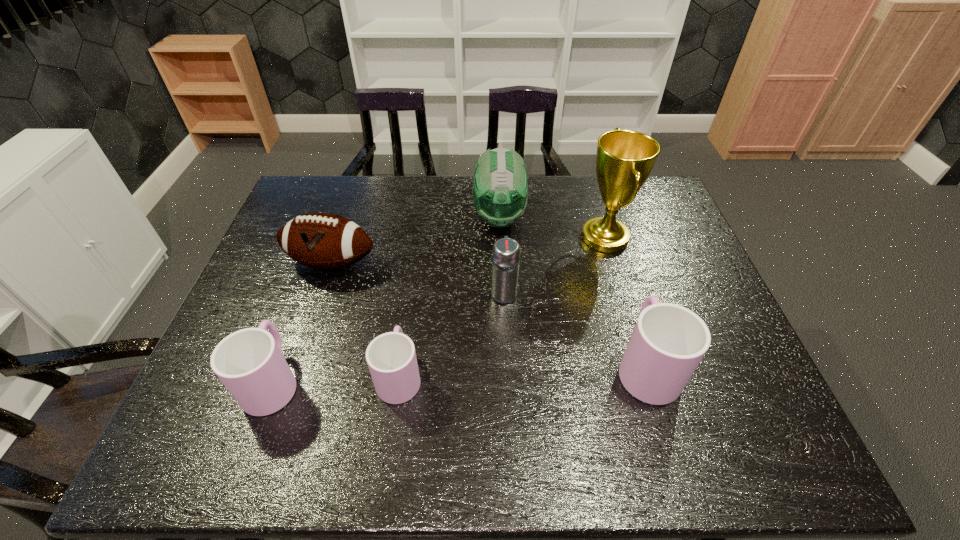
What are the coordinates of `vacant region between the football (American) and the award` in the screenshot? It's located at click(468, 250).

Locate an element on the screen. Image resolution: width=960 pixels, height=540 pixels. vacant space that is in between the leftmost cup and the third object from left to right is located at coordinates (336, 378).

What are the coordinates of `vacant area that lies between the award and the leftmost cup` in the screenshot? It's located at (439, 309).

The height and width of the screenshot is (540, 960). I want to click on unoccupied area between the rightmost cup and the thermos bottle, so click(575, 329).

Locate an element on the screen. The width and height of the screenshot is (960, 540). the second closest object to the football (American) is located at coordinates (391, 357).

This screenshot has width=960, height=540. I want to click on object that is the sixth nearest to the football (American), so click(668, 342).

At what (x,y) coordinates should I click in order to perform the action: click on the closest cup to the football helmet. Please return your answer as a coordinate pair (x, y). The height and width of the screenshot is (540, 960). Looking at the image, I should click on (668, 342).

Locate which cup ranks second in proximity to the football (American). Please provide its 2D coordinates. Your answer should be formatted as a tuple, i.e. [(x, y)], where the tuple contains the x and y coordinates of a point satisfying the conditions above.

[(391, 357)]

Locate an element on the screen. The width and height of the screenshot is (960, 540). vacant area in the image that satisfies the following two spatial constraints: 1. with the handle on the side of the rightmost cup; 2. by the handles of the tallest object is located at coordinates (607, 238).

Find the location of a particular element. This screenshot has width=960, height=540. free space that satisfies the following two spatial constraints: 1. with the handle on the side of the rightmost cup; 2. by the handles of the award is located at coordinates (607, 238).